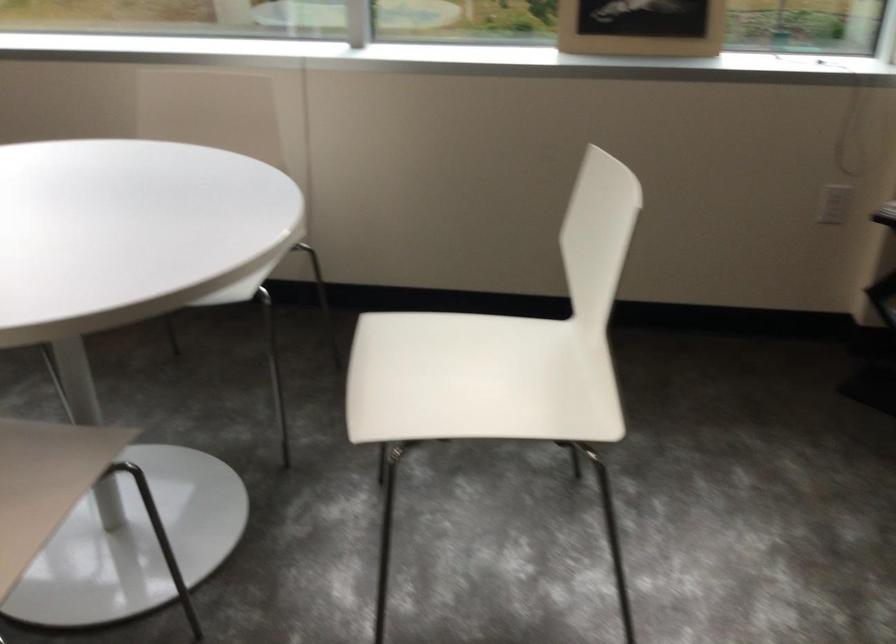
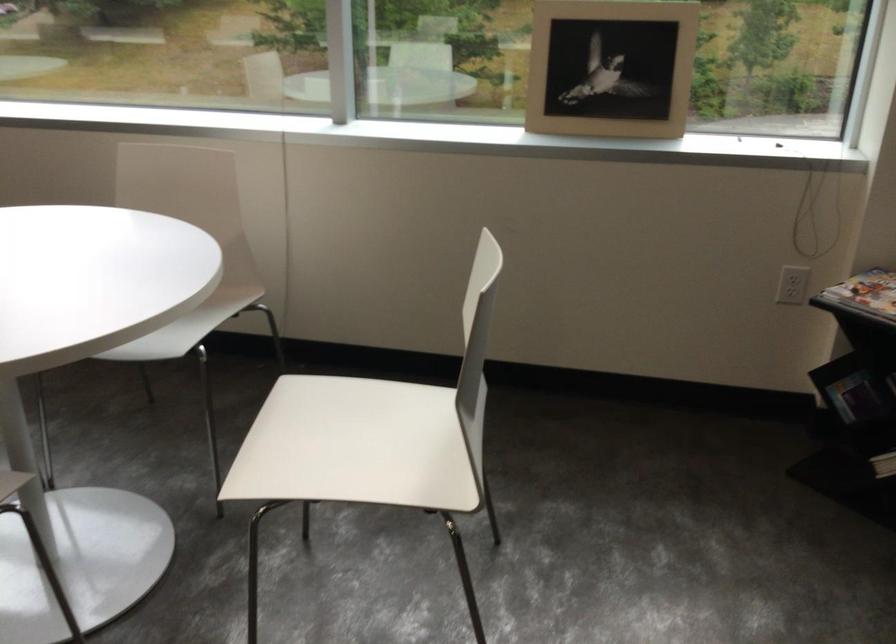
Where in the second image is the point corresponding to (x=467, y=379) from the first image?

(356, 446)